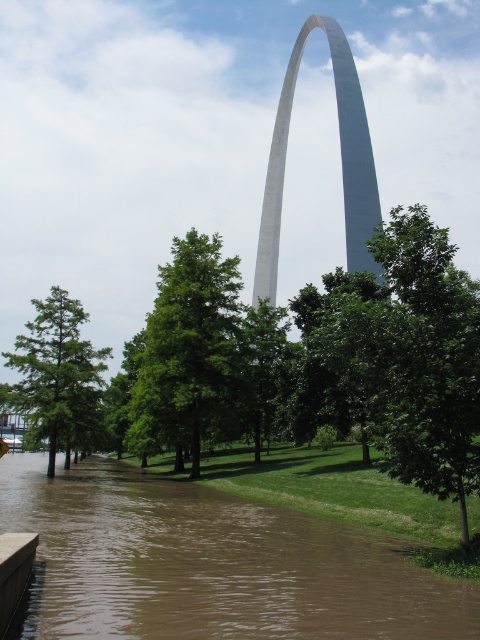
Question: Is brown muddy water at lower left bigger than white polished stone arch at center?

Choices:
 (A) no
 (B) yes

Answer: (A)

Question: Among these points, which one is nearest to the camera?

Choices:
 (A) (69, 536)
 (B) (268, 196)

Answer: (A)

Question: Does brown muddy water at lower left have a larger size compared to white polished stone arch at center?

Choices:
 (A) yes
 (B) no

Answer: (B)

Question: Does brown muddy water at lower left appear on the right side of white polished stone arch at center?

Choices:
 (A) yes
 (B) no

Answer: (B)